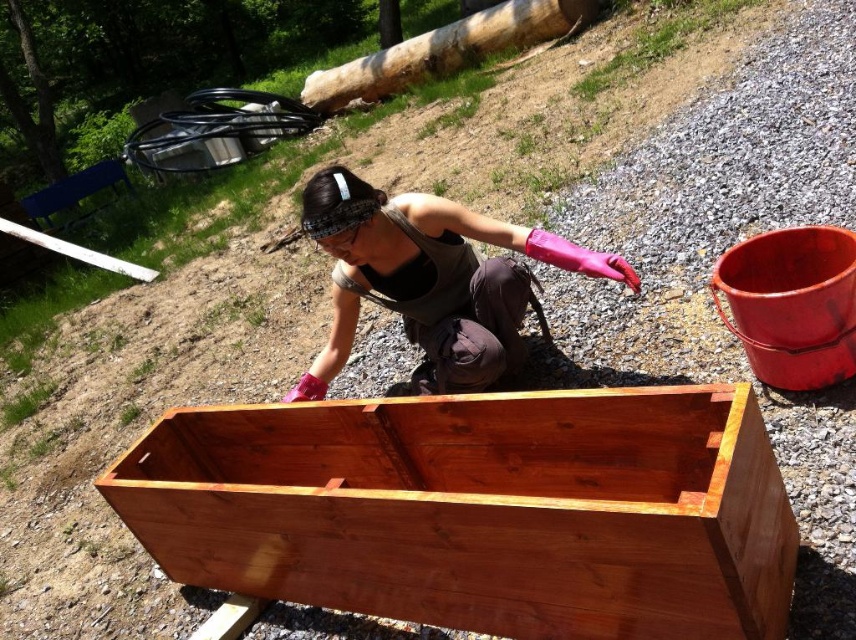
Question: Which object appears closest to the camera in this image?

Choices:
 (A) shiny brown wood crate at center
 (B) pink rubber gloves at center

Answer: (A)

Question: Does shiny brown wood crate at center appear over pink rubber gloves at center?

Choices:
 (A) no
 (B) yes

Answer: (A)

Question: In this image, where is shiny brown wood crate at center located relative to pink rubber gloves at center?

Choices:
 (A) left
 (B) right

Answer: (A)

Question: Among these objects, which one is farthest from the camera?

Choices:
 (A) shiny brown wood crate at center
 (B) pink rubber gloves at center

Answer: (B)

Question: Observing the image, what is the correct spatial positioning of shiny brown wood crate at center in reference to pink rubber gloves at center?

Choices:
 (A) below
 (B) above

Answer: (A)